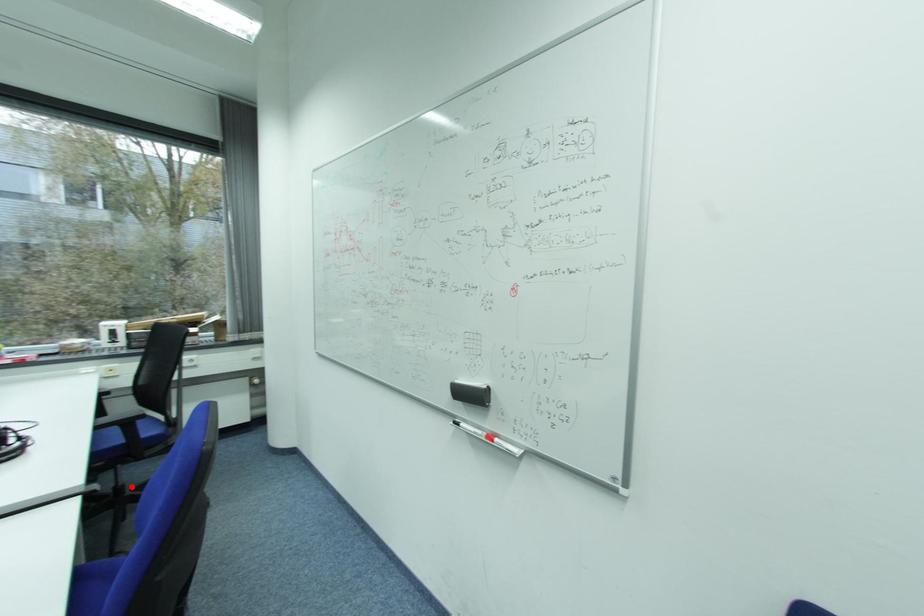
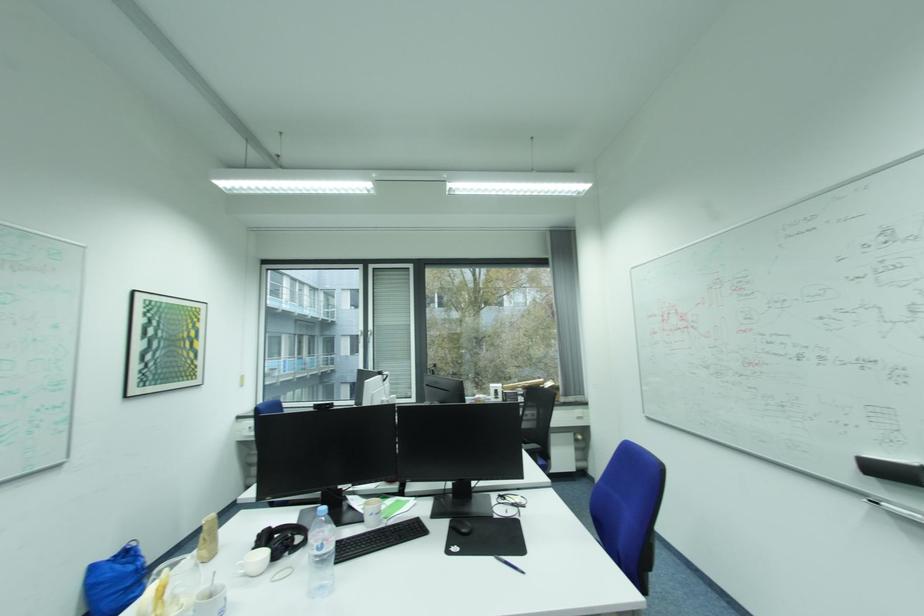
Question: I am providing you with two images of the same scene from different viewpoints. A red point is marked on the first image. Can you still see the location of the red point in image 2?

Choices:
 (A) Yes
 (B) No

Answer: (B)